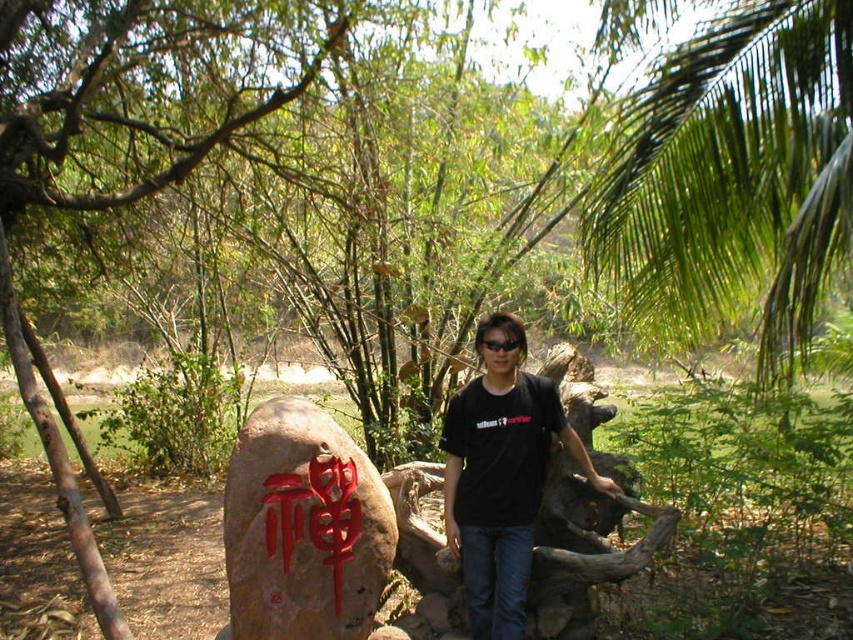
Is red painted stone at center wider than black matte t-shirt at center?

Indeed, red painted stone at center has a greater width compared to black matte t-shirt at center.

Between point (337, 433) and point (538, 387), which one is positioned behind?

Positioned behind is point (538, 387).

Which is in front, point (252, 616) or point (480, 419)?

Positioned in front is point (252, 616).

Identify the location of red painted stone at center. (303, 529).

Does point (256, 442) come farther from viewer compared to point (347, 492)?

No, it is not.

Between red painted stone at center and red carved stone at center, which one appears on the left side from the viewer's perspective?

red painted stone at center is more to the left.

Where is `red painted stone at center`? This screenshot has height=640, width=853. red painted stone at center is located at coordinates (303, 529).

Can you confirm if black matte t-shirt at center is positioned to the right of red carved stone at center?

Correct, you'll find black matte t-shirt at center to the right of red carved stone at center.

Is black matte t-shirt at center wider than red carved stone at center?

Correct, the width of black matte t-shirt at center exceeds that of red carved stone at center.

Where is `black matte t-shirt at center`? Image resolution: width=853 pixels, height=640 pixels. black matte t-shirt at center is located at coordinates (502, 476).

Image resolution: width=853 pixels, height=640 pixels. What are the coordinates of `black matte t-shirt at center` in the screenshot? It's located at (502, 476).